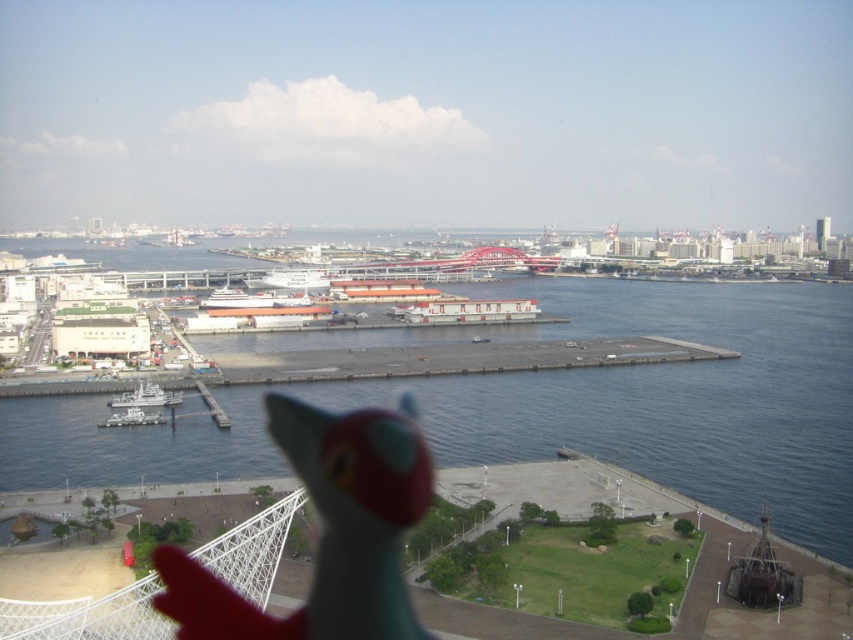
Is matte plastic toy at lower center in front of white matte ship at center?

Yes, matte plastic toy at lower center is in front of white matte ship at center.

Is matte plastic toy at lower center thinner than white matte ship at center?

Indeed, matte plastic toy at lower center has a lesser width compared to white matte ship at center.

The height and width of the screenshot is (640, 853). Find the location of `matte plastic toy at lower center`. matte plastic toy at lower center is located at coordinates (326, 531).

This screenshot has height=640, width=853. In order to click on matte plastic toy at lower center in this screenshot , I will do `click(326, 531)`.

Does matte plastic toy at lower center have a lesser width compared to white matte ship at lower left?

No.

Can you confirm if matte plastic toy at lower center is wider than white matte ship at lower left?

Correct, the width of matte plastic toy at lower center exceeds that of white matte ship at lower left.

This screenshot has width=853, height=640. What are the coordinates of `matte plastic toy at lower center` in the screenshot? It's located at (326, 531).

Is white glossy ship at lower left taller than white matte ship at lower left?

Correct, white glossy ship at lower left is much taller as white matte ship at lower left.

Who is more distant from viewer, (132, 392) or (143, 417)?

Point (132, 392)

Where is `white glossy ship at lower left`? Image resolution: width=853 pixels, height=640 pixels. white glossy ship at lower left is located at coordinates pos(144,396).